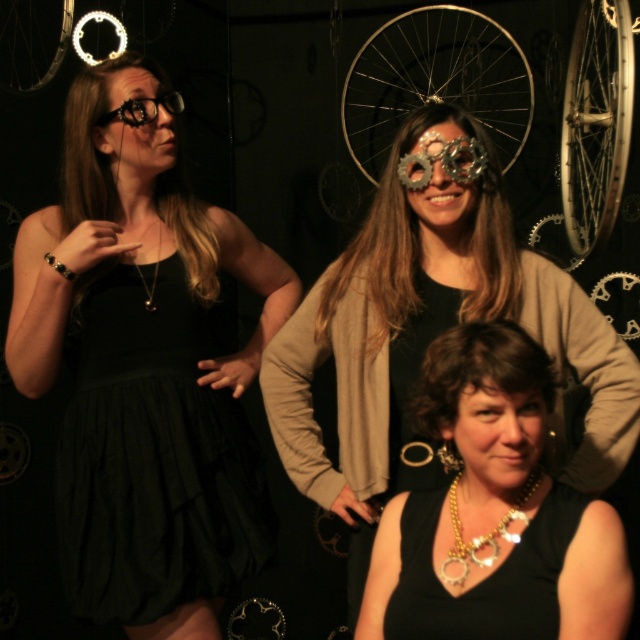
You are a photographer setting up for a group photo. You need to ensure that the silver metallic bicycle wheel at center and the metallic gear at center are both visible in the frame. Given that the camera lens has a maximum width capacity of 1.2 meters, will both objects fit within the frame?

The silver metallic bicycle wheel at center is wider than the metallic gear at center. Since the camera lens can capture up to 1.2 meters, both objects will fit as long as their combined width does not exceed the limit. However, the description only states the bicycle wheel is wider, not their exact measurements. Without specific dimensions, we cannot confirm if they fit together.

You are a photographer who wants to adjust the lighting to highlight the gold metallic necklace at lower center. Which part of the person on the left should you focus on to ensure the necklace is properly lit?

The gold metallic necklace at lower center is located at point (483, 534). To properly light it, focus on the area around the person on the left where the necklace is positioned.